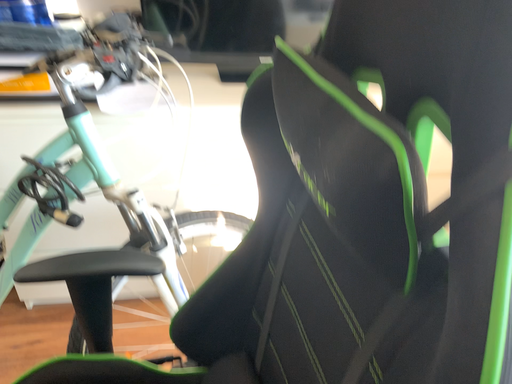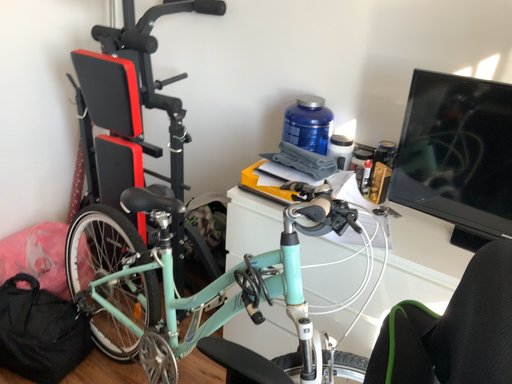
Question: Which way did the camera rotate in the video?

Choices:
 (A) rotated downward
 (B) rotated upward

Answer: (B)